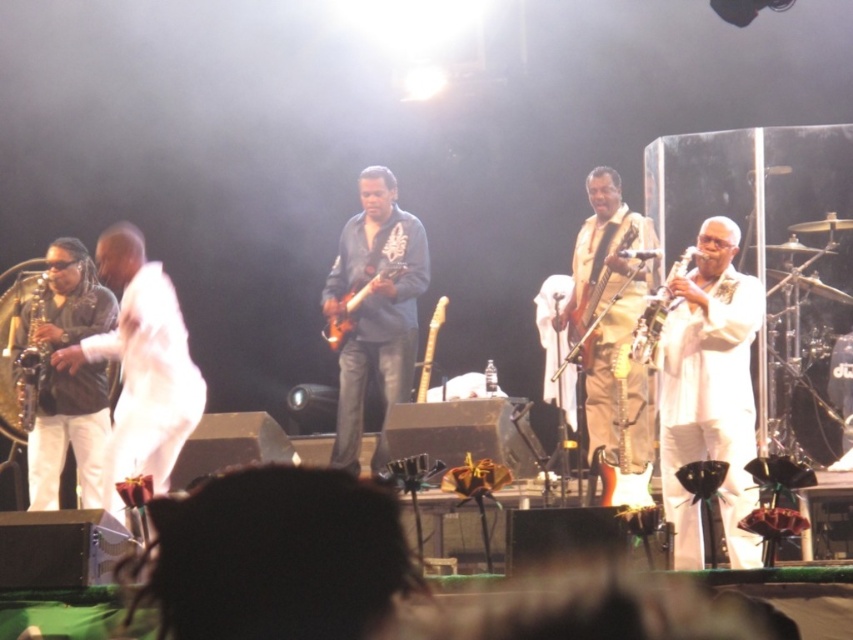
Question: Which of the following is the closest to the observer?

Choices:
 (A) wooden flute at center
 (B) matte brown saxophone at left

Answer: (B)

Question: Is matte brown saxophone at left above wooden electric guitar at center?

Choices:
 (A) no
 (B) yes

Answer: (A)

Question: Does wooden electric guitar at center appear on the left side of wooden flute at center?

Choices:
 (A) yes
 (B) no

Answer: (B)

Question: Can you confirm if wooden electric guitar at center is positioned above glossy electric guitar at center?

Choices:
 (A) yes
 (B) no

Answer: (B)

Question: Which point is closer to the camera taking this photo?

Choices:
 (A) (741, 556)
 (B) (669, 304)
 (C) (367, 292)
 (D) (24, 422)

Answer: (A)

Question: Which of the following is the closest to the observer?

Choices:
 (A) (723, 292)
 (B) (28, 428)

Answer: (A)